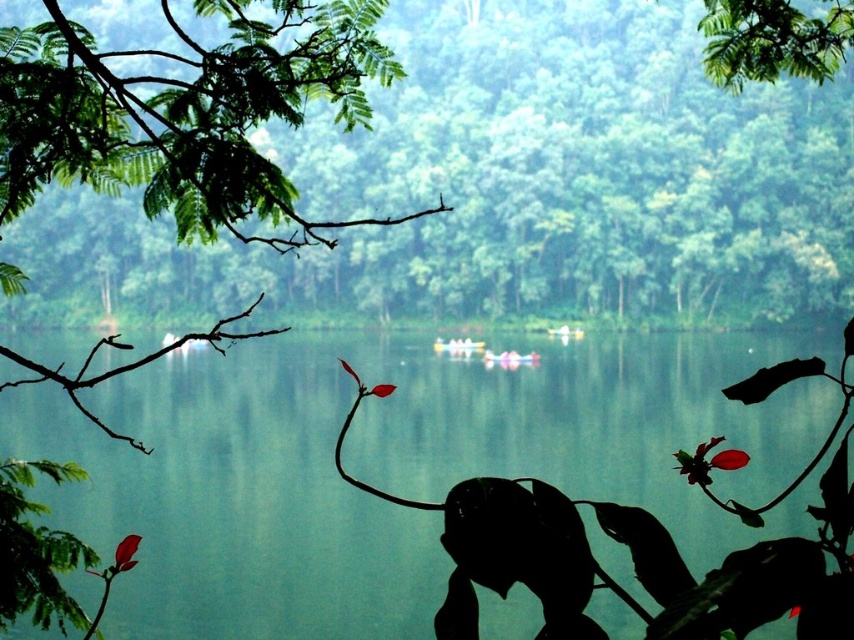
Is brown/rough branch at left taller than yellow plastic boat at center?

Indeed, brown/rough branch at left has a greater height compared to yellow plastic boat at center.

Which is in front, point (13, 387) or point (455, 340)?

Point (13, 387) is more forward.

The height and width of the screenshot is (640, 854). I want to click on brown/rough branch at left, so click(126, 365).

Can you confirm if brown/rough branch at left is wider than pink glossy boat at center?

Yes, brown/rough branch at left is wider than pink glossy boat at center.

Does point (227, 333) come behind point (490, 356)?

That is False.

At what (x,y) coordinates should I click in order to perform the action: click on brown/rough branch at left. Please return your answer as a coordinate pair (x, y). The width and height of the screenshot is (854, 640). Looking at the image, I should click on (126, 365).

Which is in front, point (202, 173) or point (692, 472)?

Point (692, 472) is in front.

Is green leafy branch at upper left smaller than dark red matte flower at lower right?

No.

Where is `green leafy branch at upper left`? green leafy branch at upper left is located at coordinates (186, 113).

At what (x,y) coordinates should I click in order to perform the action: click on green leafy branch at upper left. Please return your answer as a coordinate pair (x, y). Image resolution: width=854 pixels, height=640 pixels. Looking at the image, I should click on 186,113.